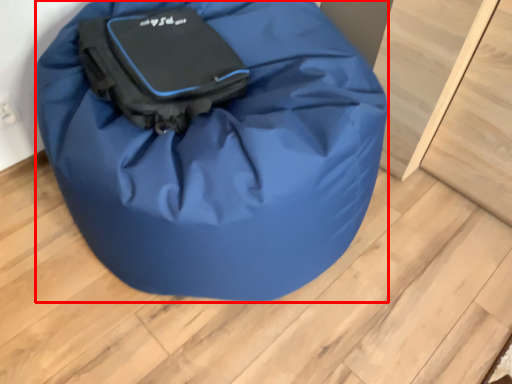
Question: From the image's perspective, what is the correct spatial relationship of luggage and bags (annotated by the red box) in relation to luggage and bags?

Choices:
 (A) below
 (B) above

Answer: (A)